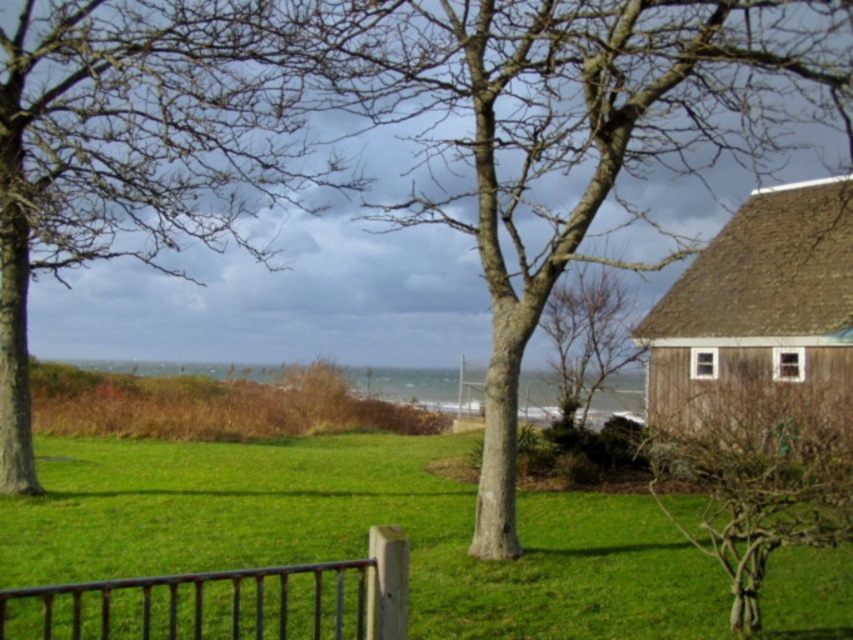
You are standing in the outdoor scene and want to place a small flag at both point (x=51, y=145) and point (x=770, y=429). Which point is closer to you when you are facing the scene?

Point (x=51, y=145) is closer to you since it is further to the camera than point (x=770, y=429).

You are standing at the origin point of the coordinate system in the image. You want to walk to the brown wooden hut at right. According to the coordinate system, in which direction should you move?

The brown wooden hut at right is located at coordinate point (759, 317), so you should move towards the right and downward direction to reach it.